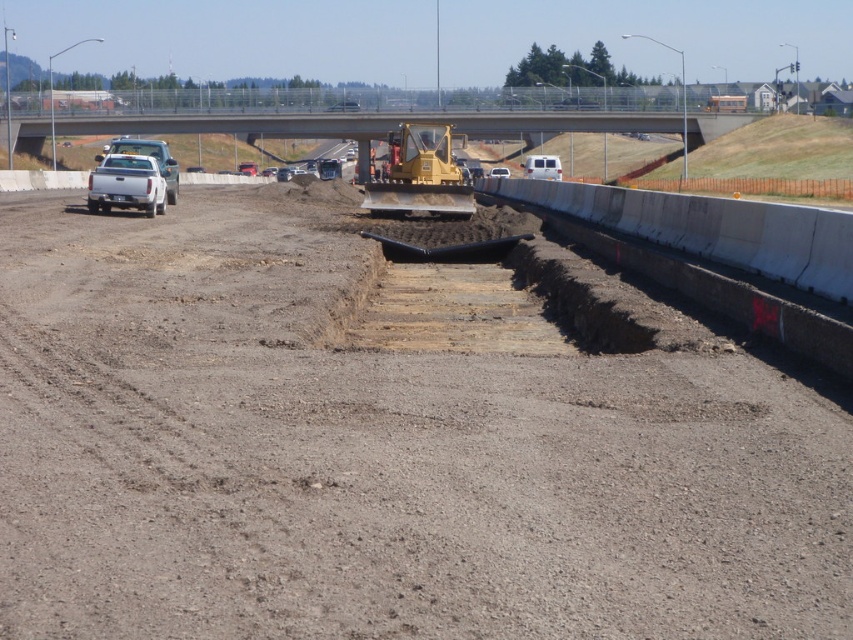
Question: Does brown dirt field at center have a lesser width compared to white matte truck at left?

Choices:
 (A) no
 (B) yes

Answer: (A)

Question: Based on their relative distances, which object is nearer to the white matte truck at center?

Choices:
 (A) brown dirt field at center
 (B) yellow metallic excavator at center
 (C) white matte truck at left

Answer: (B)

Question: Which point is farther to the camera?

Choices:
 (A) (113, 177)
 (B) (503, 172)
 (C) (582, 403)
 (D) (560, 173)

Answer: (B)

Question: Considering the relative positions of brown dirt field at center and white matte truck at center in the image provided, where is brown dirt field at center located with respect to white matte truck at center?

Choices:
 (A) right
 (B) left

Answer: (B)

Question: Among these objects, which one is nearest to the camera?

Choices:
 (A) white matte truck at center
 (B) brown dirt field at center
 (C) white matte truck at left

Answer: (B)

Question: Observing the image, what is the correct spatial positioning of yellow metallic excavator at center in reference to white matte truck at center?

Choices:
 (A) right
 (B) left

Answer: (B)